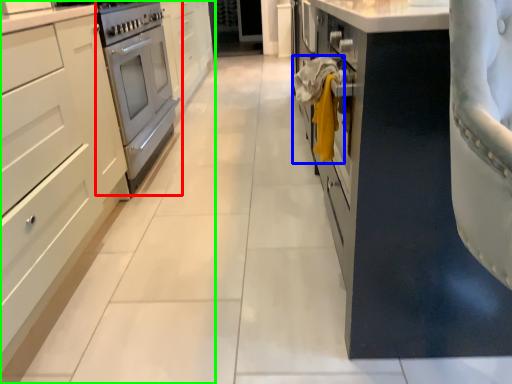
Question: Which is farther away from home appliance (highlighted by a red box)? laundry (highlighted by a blue box) or cabinetry (highlighted by a green box)?

Choices:
 (A) laundry
 (B) cabinetry

Answer: (A)